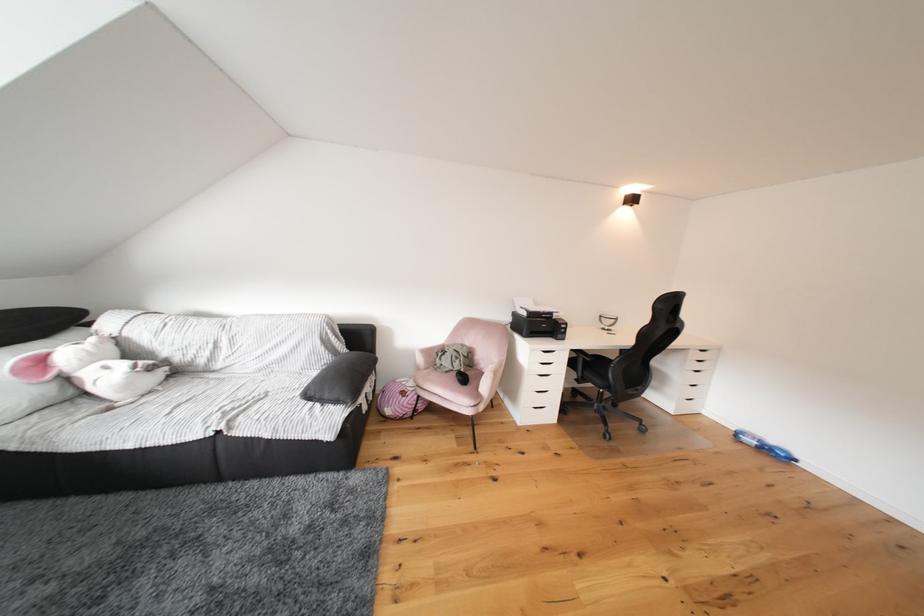
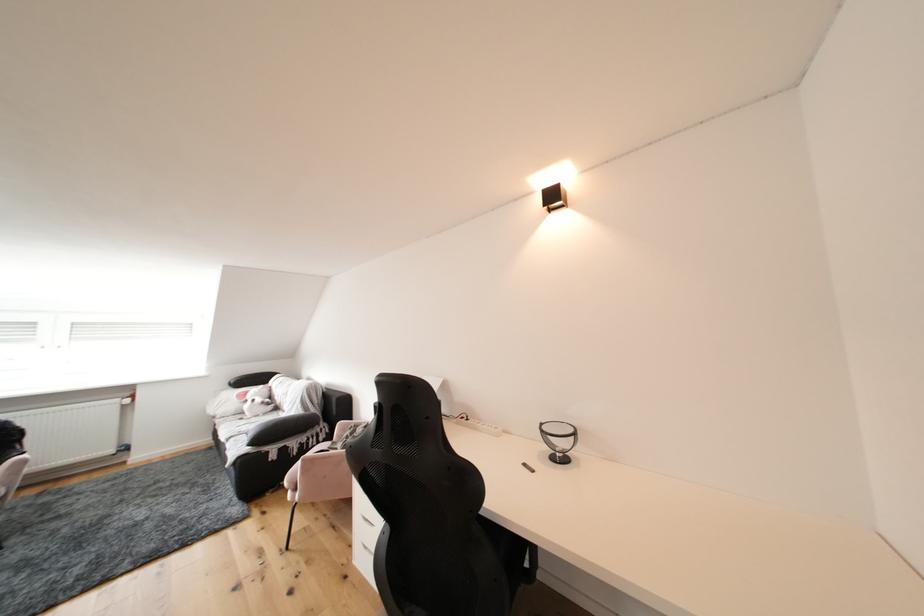
Locate, in the second image, the point that corresponds to the point at 222,379 in the first image.

(290, 416)